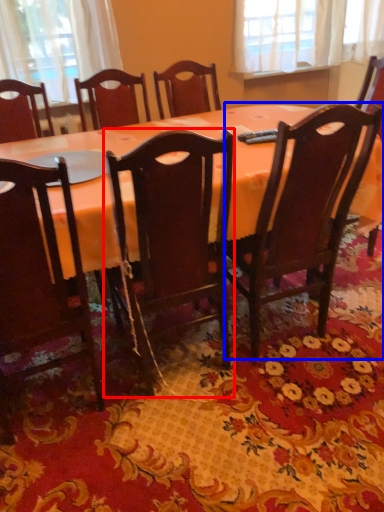
Question: Which object appears farthest to the camera in this image, chair (highlighted by a red box) or chair (highlighted by a blue box)?

Choices:
 (A) chair
 (B) chair

Answer: (B)